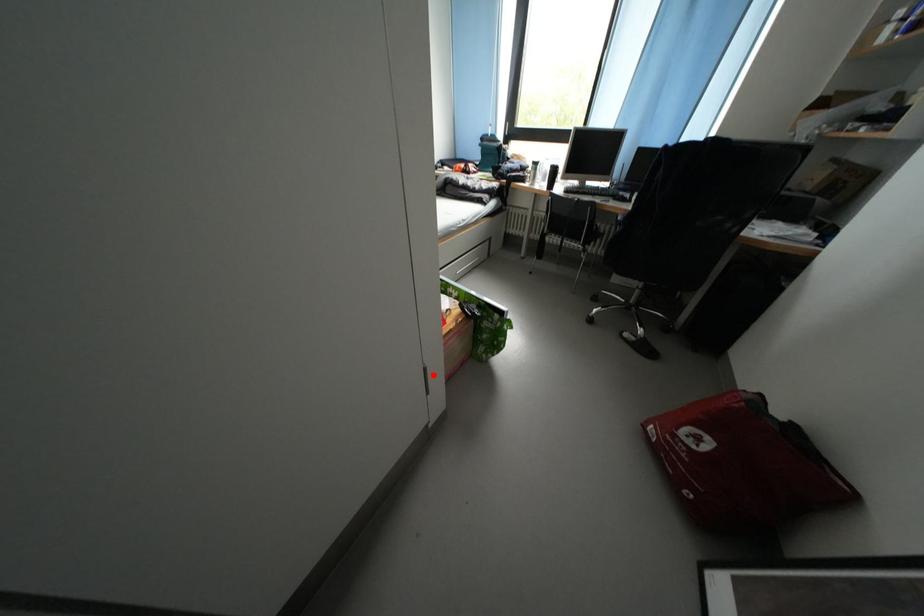
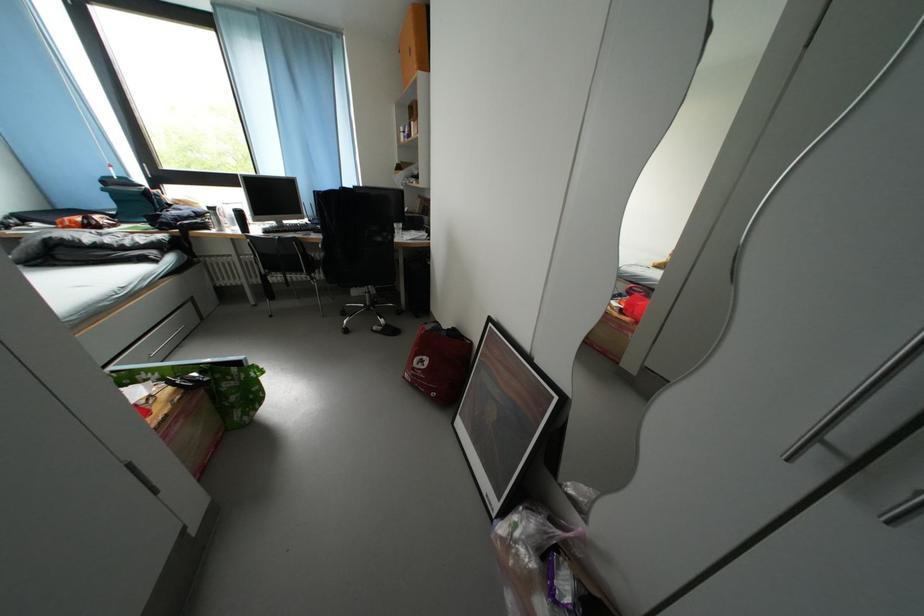
Question: I am providing you with two images of the same scene from different viewpoints. Image1 has a red point marked. In image2, the corresponding 3D location appears at what relative position? Reply with the corresponding letter.

Choices:
 (A) Closer
 (B) Farther

Answer: (B)